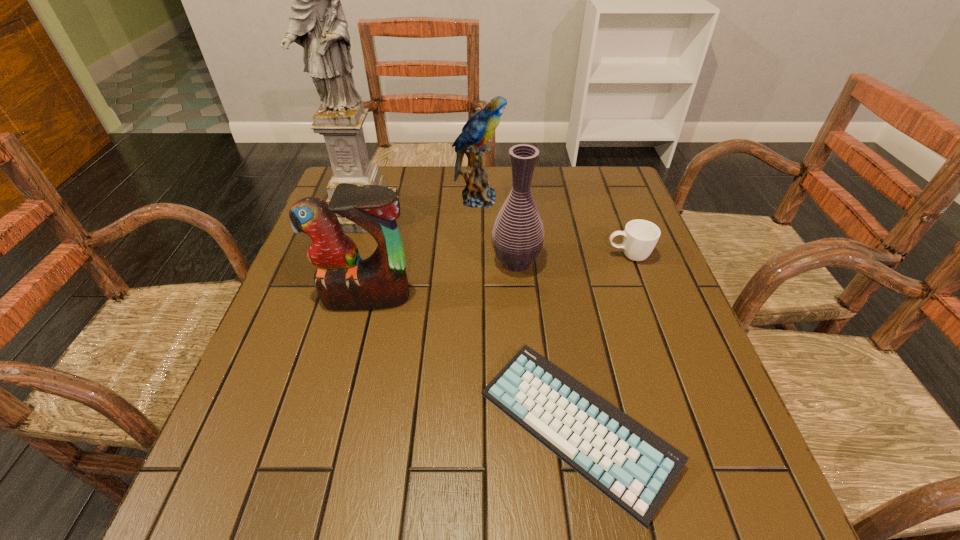
Identify the location of the tallest object. The image size is (960, 540). (317, 23).

The image size is (960, 540). I want to click on the farther parrot, so click(x=481, y=126).

At what (x,y) coordinates should I click in order to perform the action: click on vase. Please return your answer as a coordinate pair (x, y). The image size is (960, 540). Looking at the image, I should click on (518, 234).

This screenshot has width=960, height=540. I want to click on the nearer parrot, so click(344, 281).

You are a GUI agent. You are given a task and a screenshot of the screen. Output one action in this format:
    pyautogui.click(x=<x>, y=<y>)
    Task: Click on the fifth farthest object
    This screenshot has width=960, height=540.
    Given the screenshot: What is the action you would take?
    pyautogui.click(x=344, y=281)

This screenshot has width=960, height=540. Identify the location of cup. (640, 236).

Identify the location of the nearest object. (632, 466).

The image size is (960, 540). Identify the location of the shortest object. (632, 466).

Where is `vacant space located on the front-facing side of the tallest object`? This screenshot has height=540, width=960. vacant space located on the front-facing side of the tallest object is located at coordinates (341, 278).

You are a GUI agent. You are given a task and a screenshot of the screen. Output one action in this format:
    pyautogui.click(x=<x>, y=<y>)
    Task: Click on the vacant area located 0.270m on the face of the right parrot
    This screenshot has width=960, height=540.
    Given the screenshot: What is the action you would take?
    pyautogui.click(x=595, y=199)